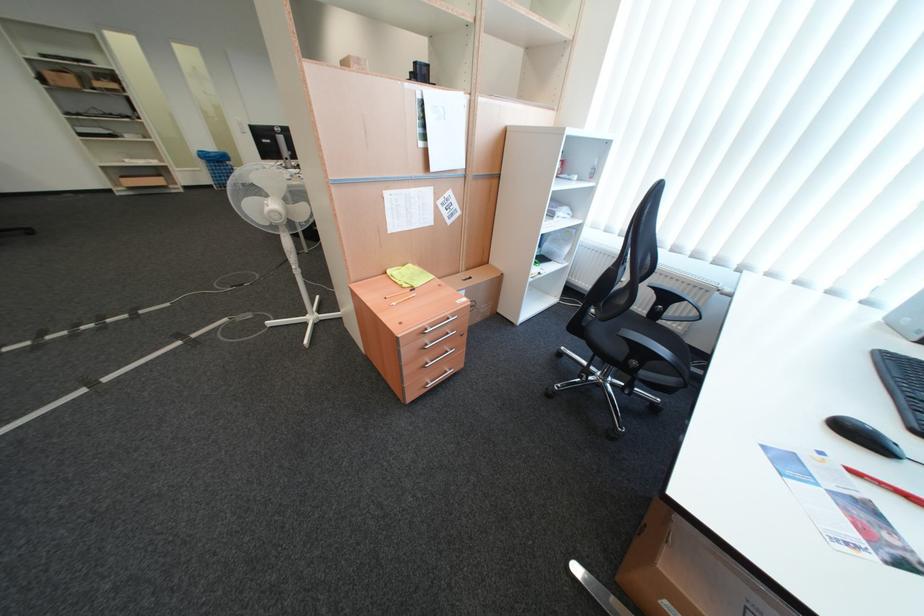
The location [885,485] corresponds to which object?

It refers to a red pencil.